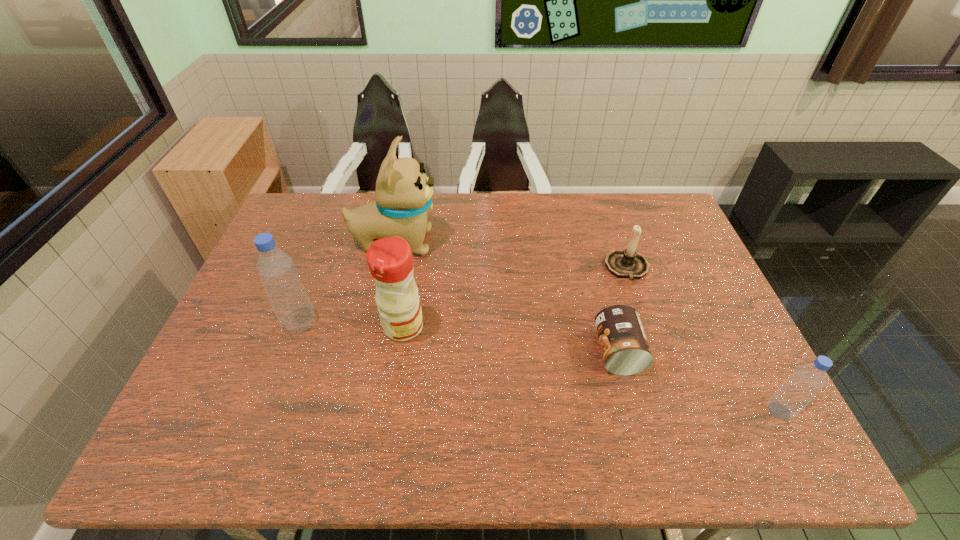
Locate an element on the screen. This screenshot has height=540, width=960. unoccupied area between the left bottle and the shortest object is located at coordinates (459, 338).

Identify the location of free space between the taller bottle and the condiment. (351, 325).

This screenshot has width=960, height=540. I want to click on vacant area that lies between the farther bottle and the puppy, so click(348, 282).

You are a GUI agent. You are given a task and a screenshot of the screen. Output one action in this format:
    pyautogui.click(x=<x>, y=<y>)
    Task: Click on the free space between the second shortest object and the puppy
    The image size is (960, 540).
    Given the screenshot: What is the action you would take?
    pyautogui.click(x=511, y=255)

I want to click on vacant space in between the condiment and the rightmost object, so click(x=591, y=369).

The image size is (960, 540). I want to click on vacant region between the condiment and the rightmost object, so click(591, 369).

Where is `object that is the fourth closest to the leftmost object`? This screenshot has height=540, width=960. object that is the fourth closest to the leftmost object is located at coordinates (628, 263).

Select which object is the second closest to the shorter bottle. Please provide its 2D coordinates. Your answer should be formatted as a tuple, i.e. [(x, y)], where the tuple contains the x and y coordinates of a point satisfying the conditions above.

[(628, 263)]

The image size is (960, 540). I want to click on free location that satisfies the following two spatial constraints: 1. on the front side of the third shortest object; 2. on the right side of the leftmost object, so click(x=267, y=411).

At what (x,y) coordinates should I click in order to perform the action: click on vacant space that satisfies the following two spatial constraints: 1. on the front side of the candle holder; 2. on the front label of the can. Please return your answer as a coordinate pair (x, y). Image resolution: width=960 pixels, height=540 pixels. Looking at the image, I should click on (656, 352).